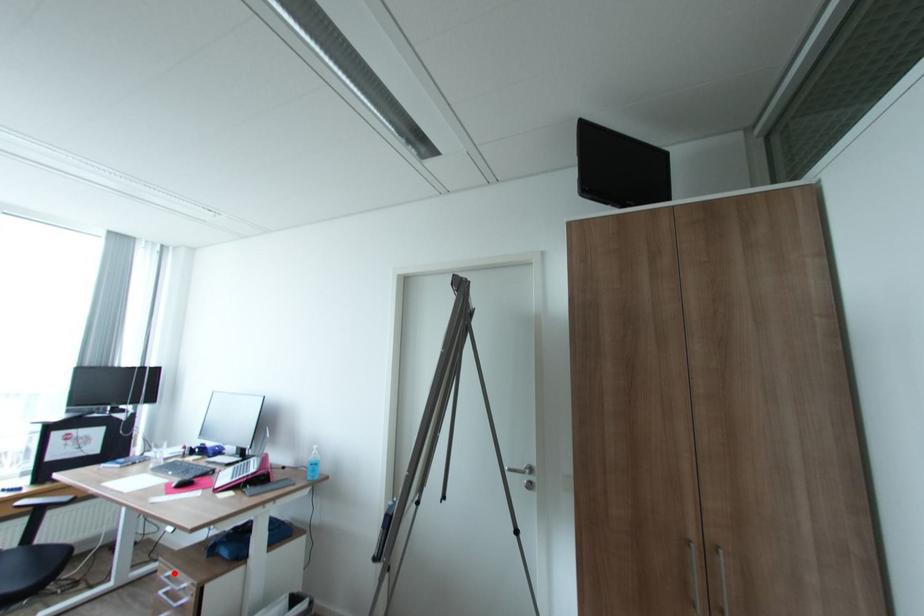
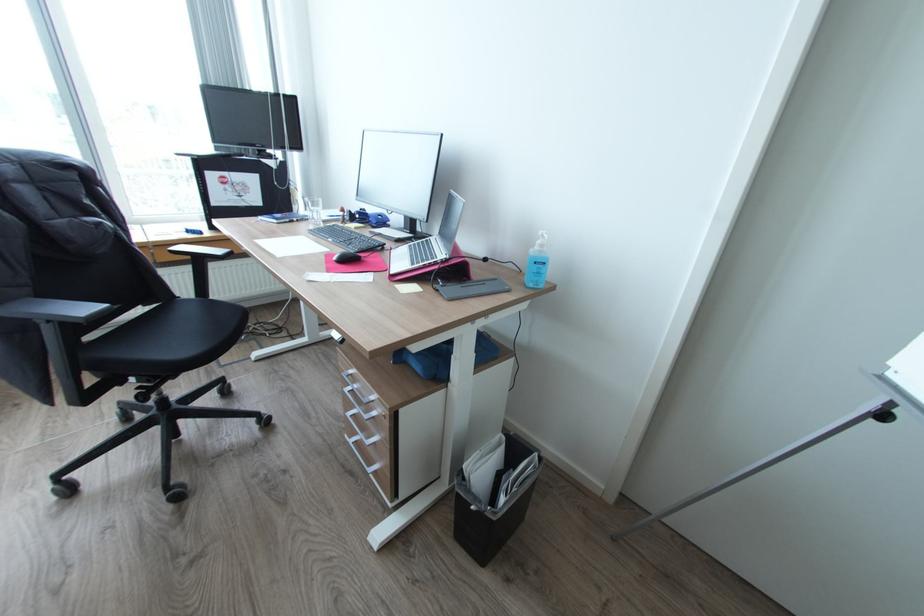
Question: I am providing you with two images of the same scene from different viewpoints. A red point is shown in image1. For the corresponding object point in image2, is it positioned nearer or farther from the camera?

Choices:
 (A) Nearer
 (B) Farther

Answer: (B)